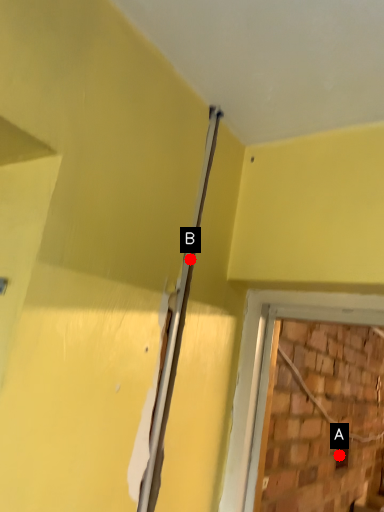
Question: Two points are circled on the image, labeled by A and B beside each circle. Which of the following is the closest to the observer?

Choices:
 (A) A is closer
 (B) B is closer

Answer: (B)